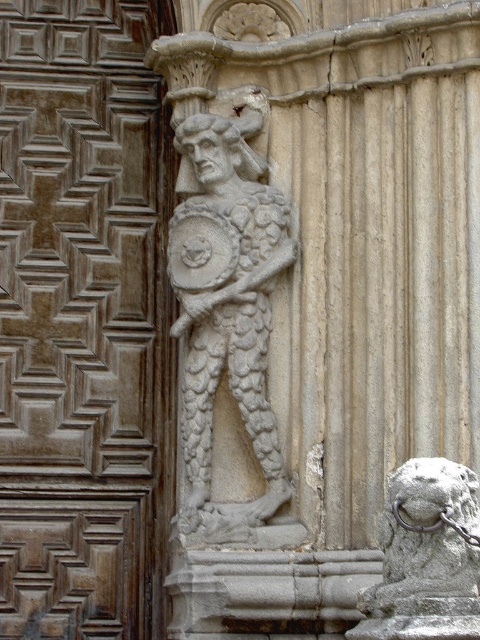
How far apart are brown wood door at center and gray stone lion at lower right?

brown wood door at center and gray stone lion at lower right are 10.63 meters apart from each other.

Can you confirm if brown wood door at center is positioned to the left of gray stone lion at lower right?

Correct, you'll find brown wood door at center to the left of gray stone lion at lower right.

Between point (46, 92) and point (464, 513), which one is positioned in front?

Positioned in front is point (464, 513).

Where is `brown wood door at center`? Image resolution: width=480 pixels, height=640 pixels. brown wood door at center is located at coordinates (83, 320).

Does brown wood door at center have a smaller size compared to carved stone warrior at center?

No, brown wood door at center is not smaller than carved stone warrior at center.

Which is in front, point (87, 275) or point (265, 236)?

Point (265, 236)

Identify the location of brown wood door at center. The width and height of the screenshot is (480, 640). pos(83,320).

Who is higher up, carved stone warrior at center or gray stone lion at lower right?

carved stone warrior at center

Does carved stone warrior at center appear under gray stone lion at lower right?

No.

Between point (188, 120) and point (416, 616), which one is positioned behind?

The point (188, 120) is more distant.

Where is `carved stone warrior at center`? carved stone warrior at center is located at coordinates (227, 305).